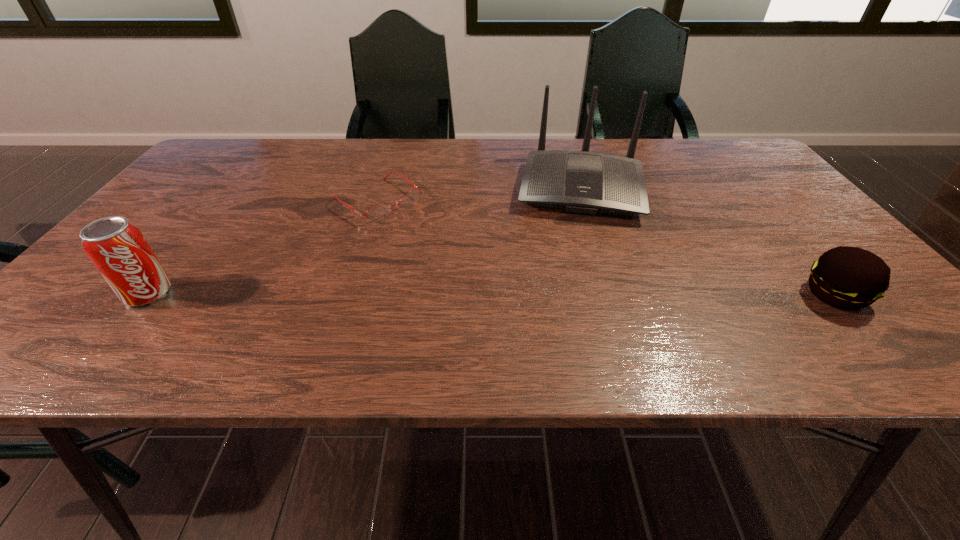
I want to click on empty space between the third tallest object and the spectacles, so click(606, 247).

Identify the location of blank region between the shortest object and the rightmost object. (606, 247).

At what (x,y) coordinates should I click in order to perform the action: click on blank region between the router and the third object from right to left. Please return your answer as a coordinate pair (x, y). This screenshot has width=960, height=540. Looking at the image, I should click on point(479,194).

Where is `vacant space that is in between the spectacles and the patty`? Image resolution: width=960 pixels, height=540 pixels. vacant space that is in between the spectacles and the patty is located at coordinates (606, 247).

The height and width of the screenshot is (540, 960). What are the coordinates of `unoccupied area between the patty and the tallest object` in the screenshot? It's located at (708, 241).

The height and width of the screenshot is (540, 960). Identify the location of free space between the rightmost object and the leftmost object. (492, 294).

Find the location of a particular element. empty space between the rightmost object and the spectacles is located at coordinates (606, 247).

Locate an element on the screen. blank region between the third object from left to right and the second shortest object is located at coordinates (708, 241).

At what (x,y) coordinates should I click in order to perform the action: click on the second closest object to the spectacles. Please return your answer as a coordinate pair (x, y). The height and width of the screenshot is (540, 960). Looking at the image, I should click on click(x=117, y=248).

Select which object is the third closest to the third object from left to right. Please provide its 2D coordinates. Your answer should be formatted as a tuple, i.e. [(x, y)], where the tuple contains the x and y coordinates of a point satisfying the conditions above.

[(117, 248)]